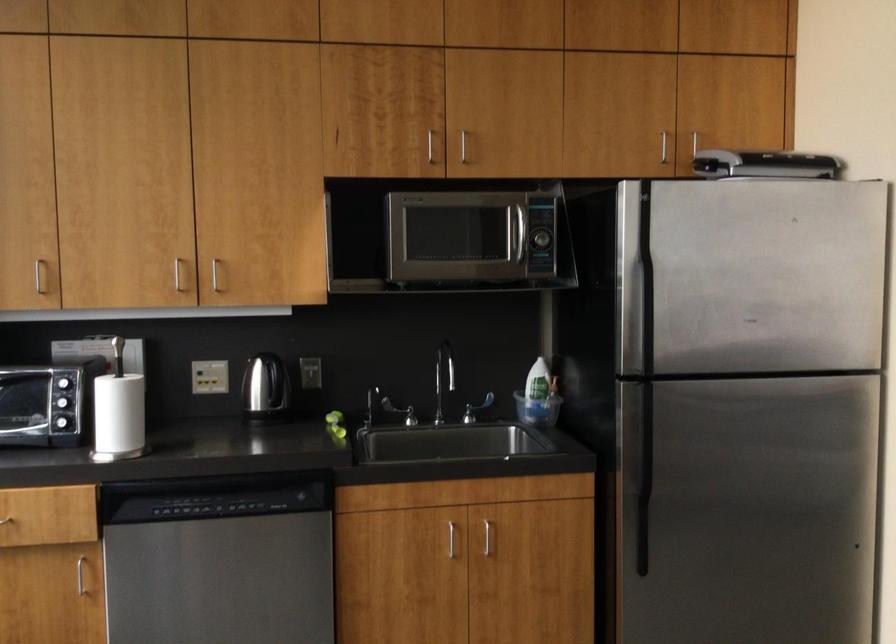
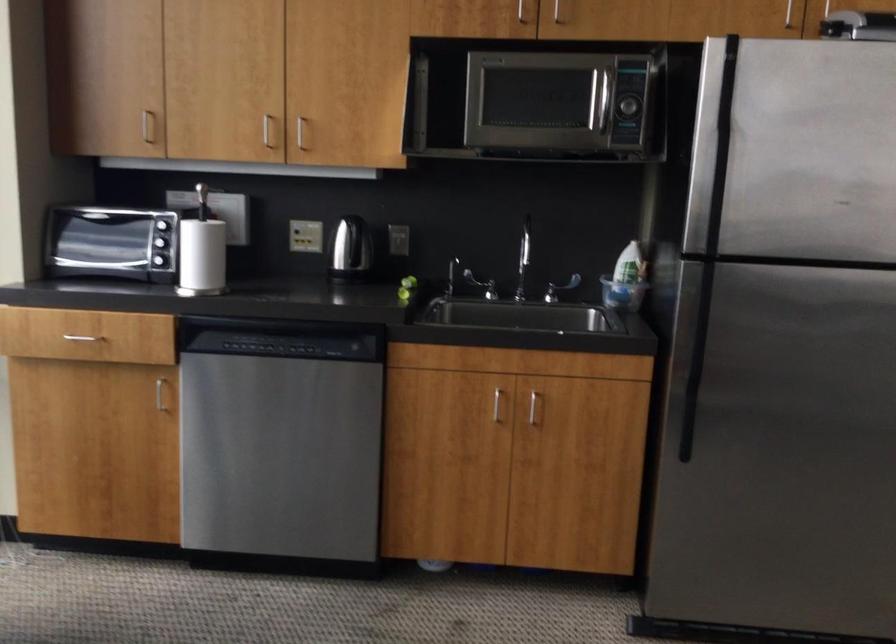
Find the pixel in the second image that matches point (398, 412) in the first image.

(480, 285)